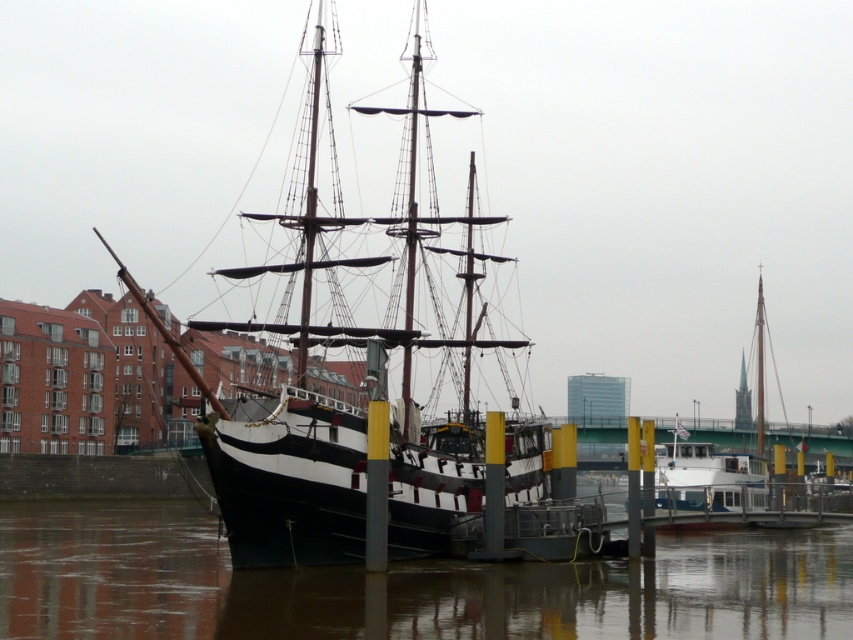
Is black polished wood ship at center further to the viewer compared to white matte sailboat at right?

No, black polished wood ship at center is in front of white matte sailboat at right.

Does point (469, 481) come farther from viewer compared to point (759, 352)?

No, (469, 481) is in front of (759, 352).

At what (x,y) coordinates should I click in order to perform the action: click on black polished wood ship at center. Please return your answer as a coordinate pair (x, y). Looking at the image, I should click on (378, 259).

Does brown water at lower center have a greater width compared to white matte sailboat at right?

Correct, the width of brown water at lower center exceeds that of white matte sailboat at right.

What are the coordinates of `brown water at lower center` in the screenshot? It's located at (641, 592).

Find the location of a particular element. brown water at lower center is located at coordinates (641, 592).

Between brown water at lower center and black polished wood ship at center, which one appears on the right side from the viewer's perspective?

black polished wood ship at center

Is brown water at lower center closer to the viewer compared to black polished wood ship at center?

Yes.

Is point (212, 556) less distant than point (241, 474)?

That is False.

Where is `brown water at lower center`? Image resolution: width=853 pixels, height=640 pixels. brown water at lower center is located at coordinates (641, 592).